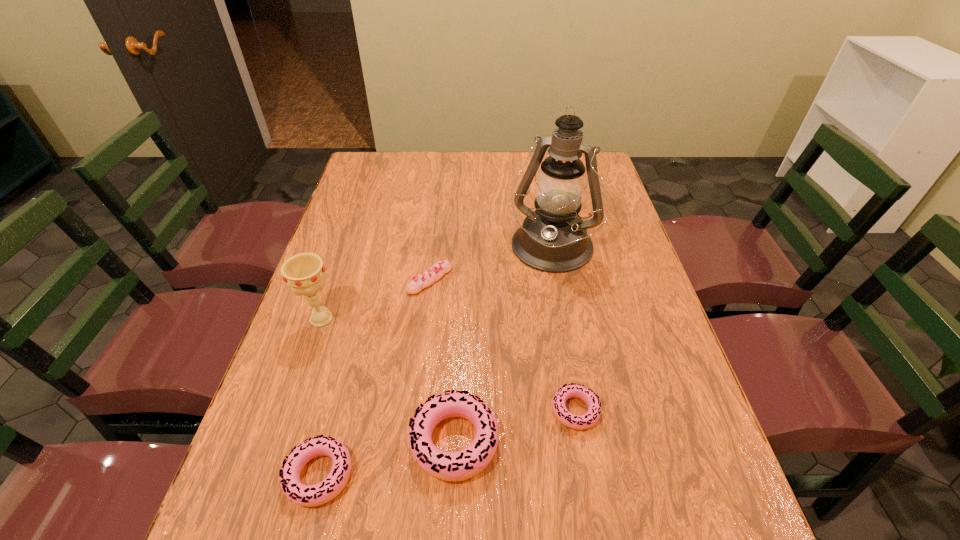
Where is `the leftmost doughnut`? the leftmost doughnut is located at coordinates (305, 495).

At what (x,y) coordinates should I click in order to perform the action: click on the fourth shortest object. Please return your answer as a coordinate pair (x, y). Looking at the image, I should click on (461, 465).

At what (x,y) coordinates should I click in order to perform the action: click on the second doughnut from left to right. Please return your answer as a coordinate pair (x, y). The width and height of the screenshot is (960, 540). Looking at the image, I should click on (461, 465).

The height and width of the screenshot is (540, 960). Find the location of `the rightmost doughnut`. the rightmost doughnut is located at coordinates pos(579,422).

You are a GUI agent. You are given a task and a screenshot of the screen. Output one action in this format:
    pyautogui.click(x=<x>, y=<y>)
    Task: Click on the eclair
    
    Given the screenshot: What is the action you would take?
    [x=439, y=269]

Locate an element on the screen. This screenshot has width=960, height=540. the fourth nearest object is located at coordinates click(305, 274).

I want to click on chalice, so click(305, 274).

The height and width of the screenshot is (540, 960). I want to click on the tallest object, so click(x=553, y=238).

Locate an element on the screen. The width and height of the screenshot is (960, 540). free space located 0.200m on the back of the leftmost doughnut is located at coordinates (349, 359).

I want to click on blank space located 0.060m on the back of the second doughnut from left to right, so click(457, 377).